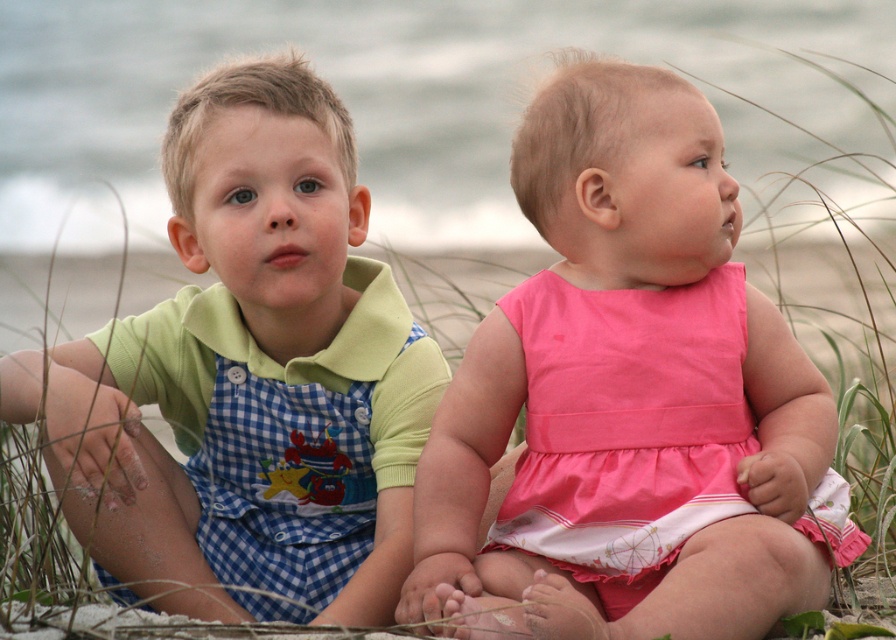
You are a photographer trying to capture both the pink satin dress at center and the checkered fabric overalls at left in the same frame. Based on their positions, which one will appear larger in the photo?

The pink satin dress at center will appear larger in the photo because it is closer to the viewer than the checkered fabric overalls at left.

You are a photographer trying to capture a photo of both the pink satin dress at center and the checkered fabric overalls at left. Since you want both subjects to be in focus, you need to know their positions relative to each other. Which one is positioned to the right of the other?

The pink satin dress at center is to the right of the checkered fabric overalls at left.

You are a photographer trying to capture both the pink satin dress at center and the checkered fabric overalls at left in a single frame. Based on their sizes, which one should you focus on to ensure both are clearly visible in the photo?

Result: The pink satin dress at center is smaller than the checkered fabric overalls at left, so focusing on the checkered fabric overalls at left would help ensure both are clearly visible since it is larger and can serve as a focal point while the smaller dress remains in frame.